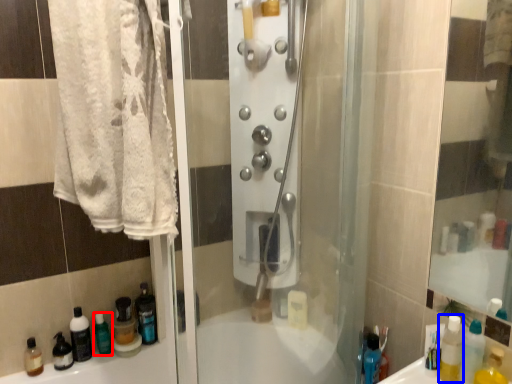
Question: Which point is further to the camera, cleaning product (highlighted by a red box) or mouthwash (highlighted by a blue box)?

Choices:
 (A) cleaning product
 (B) mouthwash

Answer: (A)